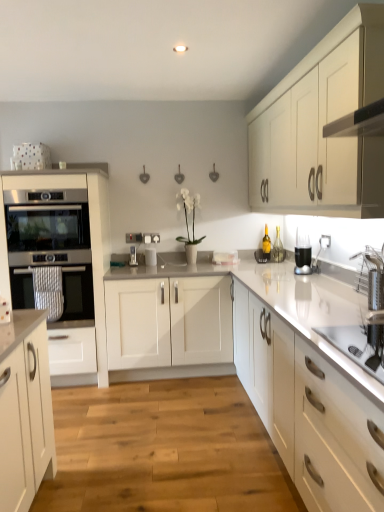
Identify the location of blank space situated above wooden floor at center (from a real-world perspective). (167, 432).